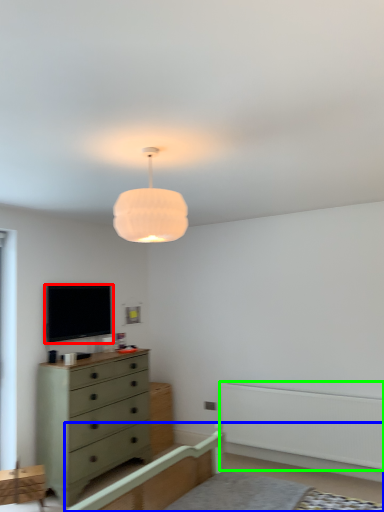
Question: Based on their relative distances, which object is nearer to television (highlighted by a red box)? Choose from bed frame (highlighted by a blue box) and balustrade (highlighted by a green box).

Choices:
 (A) bed frame
 (B) balustrade

Answer: (A)